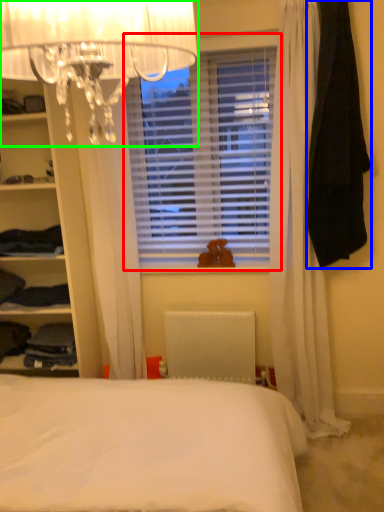
Question: Considering the real-world distances, which object is closest to window blind (highlighted by a red box)? clothing (highlighted by a blue box) or lamp (highlighted by a green box).

Choices:
 (A) clothing
 (B) lamp

Answer: (A)